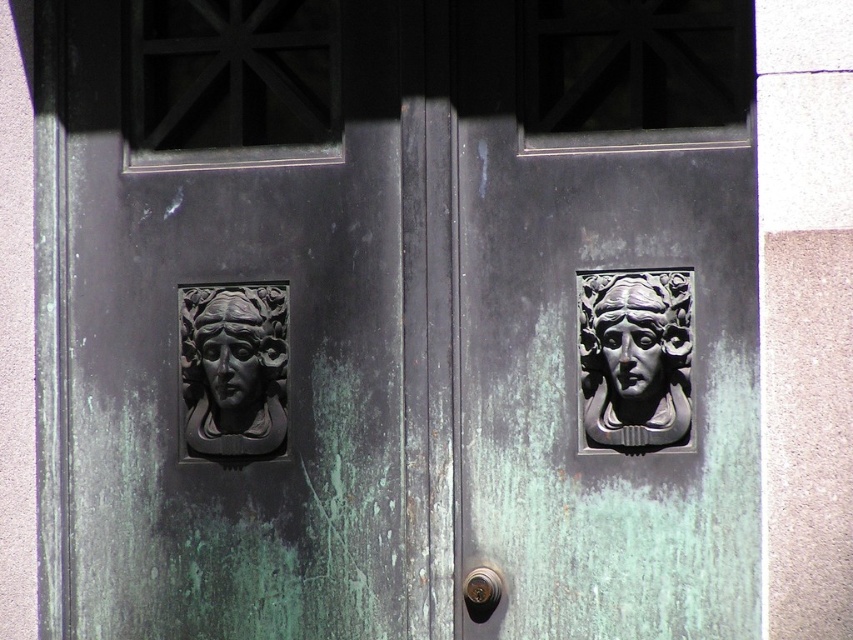
Between green patina face at left and polished brass knob at center, which one is positioned lower?

polished brass knob at center is lower down.

Looking at this image, which is above, green patina face at left or polished brass knob at center?

green patina face at left is above.

Which is behind, point (245, 403) or point (477, 602)?

The point (245, 403) is behind.

This screenshot has height=640, width=853. In order to click on green patina face at left in this screenshot , I will do [231, 356].

Which is more to the left, matte black relief at left or polished brass knob at center?

Positioned to the left is matte black relief at left.

Can you confirm if matte black relief at left is shorter than polished brass knob at center?

Incorrect, matte black relief at left's height does not fall short of polished brass knob at center's.

Which is behind, point (194, 358) or point (476, 595)?

The point (194, 358) is behind.

Where is `matte black relief at left`? The image size is (853, 640). matte black relief at left is located at coordinates (234, 369).

Between matte bronze mask at right and green patina face at left, which one has less height?

Standing shorter between the two is green patina face at left.

Who is more forward, (x=688, y=330) or (x=262, y=394)?

Point (x=688, y=330)

Which is in front, point (666, 394) or point (231, 294)?

Point (666, 394) is in front.

Image resolution: width=853 pixels, height=640 pixels. In order to click on matte bronze mask at right in this screenshot , I will do `click(635, 356)`.